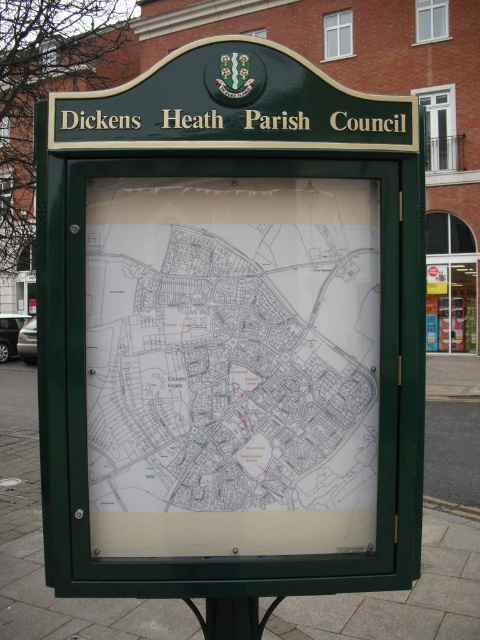
You are a tourist holding a 10 cm wide travel guide. You want to place it next to the white paper map at center and the black plastic pole at lower center. Which object can the travel guide fit next to without exceeding its width?

The travel guide can fit next to the black plastic pole at lower center because the white paper map at center is wider than the black plastic pole at lower center, so the travel guide won

You are a tourist holding a 15 cm tall guidebook and standing in front of the white paper map at center and the black plastic pole at lower center. Which object is taller?

The white paper map at center is taller than the black plastic pole at lower center according to the description.